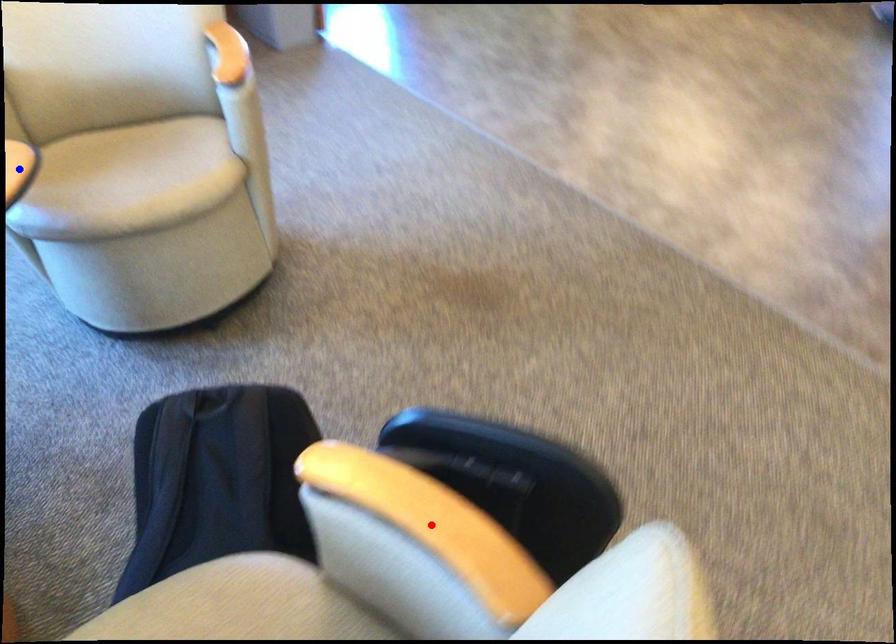
Question: In the image, two points are highlighted. Which point is nearer to the camera? Reply with the corresponding letter.

Choices:
 (A) blue point
 (B) red point

Answer: (B)